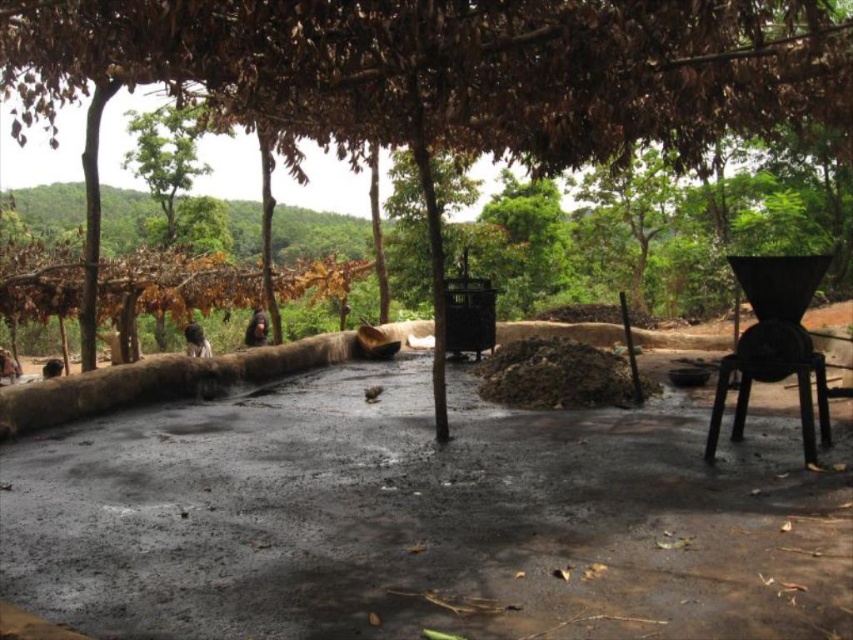
Question: Which of the following is the closest to the observer?

Choices:
 (A) green leafy tree at upper left
 (B) brown leafy tree at center
 (C) black plastic stool at lower right

Answer: (B)

Question: Where is brown leafy tree at center located in relation to black plastic stool at lower right in the image?

Choices:
 (A) left
 (B) right

Answer: (A)

Question: Is brown leafy tree at center above green leafy tree at upper left?

Choices:
 (A) yes
 (B) no

Answer: (B)

Question: Can you confirm if green leafy tree at upper left is thinner than black plastic stool at lower right?

Choices:
 (A) no
 (B) yes

Answer: (A)

Question: Which object is the farthest from the black plastic stool at lower right?

Choices:
 (A) green leafy tree at upper left
 (B) brown leafy tree at center

Answer: (A)

Question: Which point is closer to the camera?

Choices:
 (A) (592, 51)
 (B) (129, 154)
 (C) (704, 452)

Answer: (A)